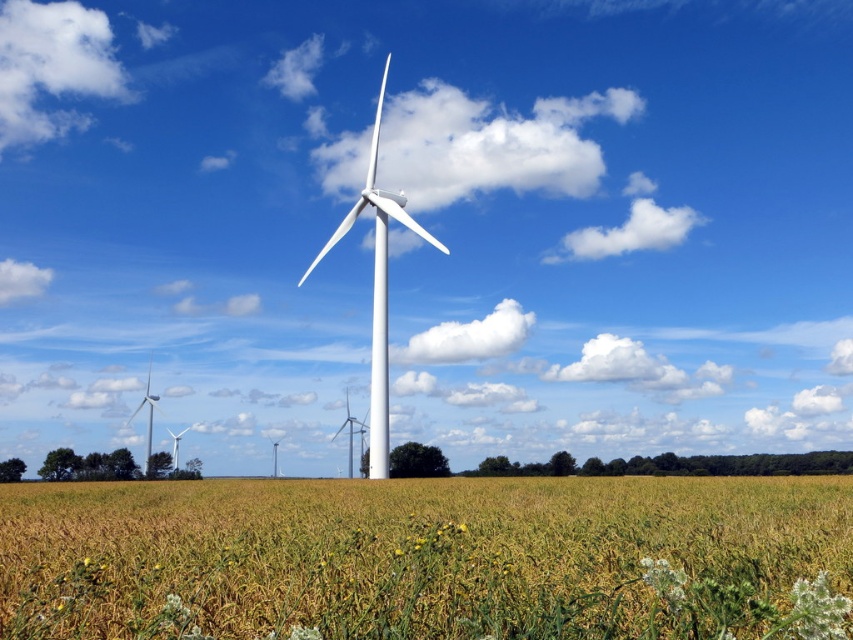
Consider the image. Is white matte wind turbine at center taller than white matte windmill at left?

Yes, white matte wind turbine at center is taller than white matte windmill at left.

Is white matte wind turbine at center positioned behind white matte windmill at left?

No, white matte wind turbine at center is closer to the viewer.

Which is in front, point (378, 449) or point (157, 404)?

Positioned in front is point (378, 449).

Locate an element on the screen. white matte wind turbine at center is located at coordinates (376, 289).

The height and width of the screenshot is (640, 853). What are the coordinates of `yellow grass at center` in the screenshot? It's located at (428, 557).

Is yellow grass at center wider than white matte windmill at left?

Yes.

What do you see at coordinates (428, 557) in the screenshot? I see `yellow grass at center` at bounding box center [428, 557].

At what (x,y) coordinates should I click in order to perform the action: click on yellow grass at center. Please return your answer as a coordinate pair (x, y). The height and width of the screenshot is (640, 853). Looking at the image, I should click on (428, 557).

Can you confirm if yellow grass at center is shorter than white matte wind turbine at center?

Indeed, yellow grass at center has a lesser height compared to white matte wind turbine at center.

Does yellow grass at center lie behind white matte wind turbine at center?

No, it is in front of white matte wind turbine at center.

The width and height of the screenshot is (853, 640). In order to click on yellow grass at center in this screenshot , I will do `click(428, 557)`.

Identify the location of yellow grass at center. The image size is (853, 640). (428, 557).